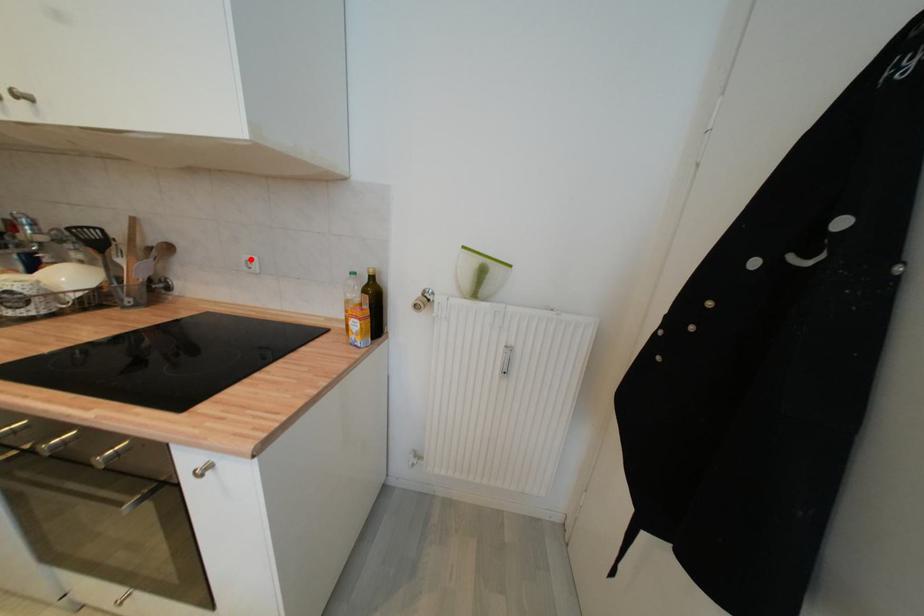
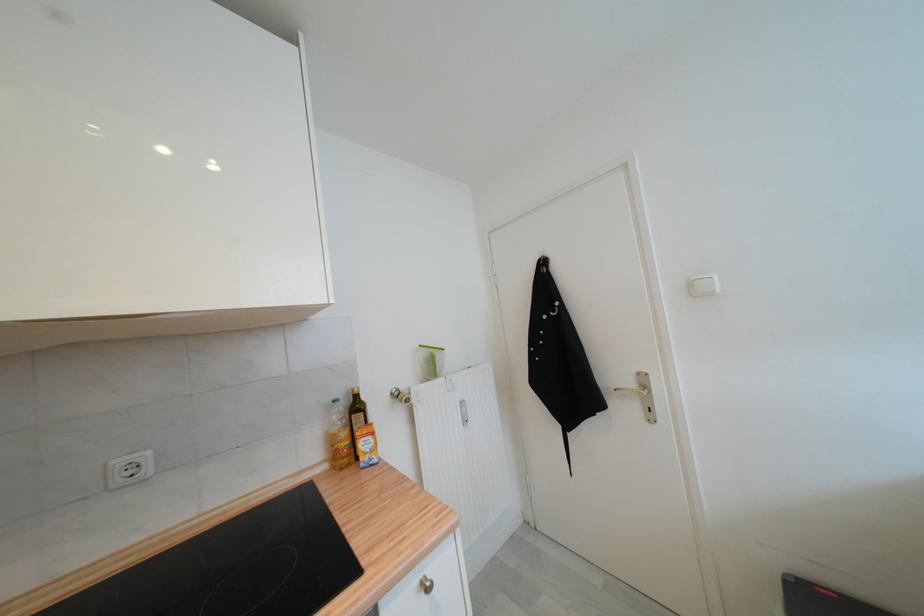
Where in the second image is the point corresponding to the highlighted location from the first image?

(126, 464)